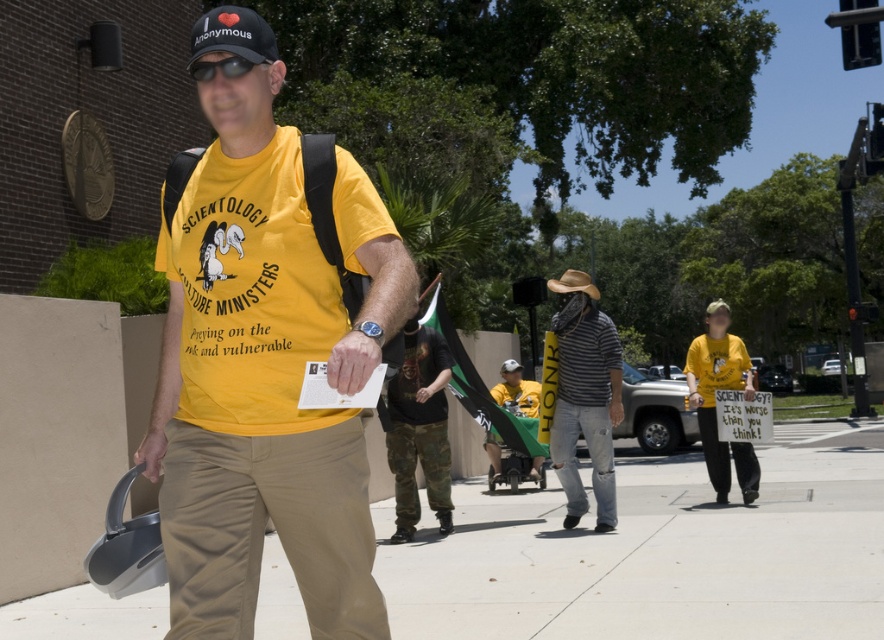
Question: Can you confirm if smooth concrete sidewalk at center is positioned above striped cotton shirt at center?

Choices:
 (A) no
 (B) yes

Answer: (A)

Question: Which of these objects is positioned closest to the camo pants at center?

Choices:
 (A) smooth concrete sidewalk at center
 (B) striped cotton shirt at center
 (C) yellow t-shirt at center

Answer: (B)

Question: Which point is farther to the camera?

Choices:
 (A) striped cotton shirt at center
 (B) yellow matte t-shirt at center

Answer: (A)

Question: Which object is closer to the camera taking this photo?

Choices:
 (A) yellow matte t-shirt at center
 (B) camo pants at center
 (C) striped cotton shirt at center

Answer: (A)

Question: Is camo pants at center to the right of yellow t-shirt at center from the viewer's perspective?

Choices:
 (A) no
 (B) yes

Answer: (A)

Question: Considering the relative positions of smooth concrete sidewalk at center and camo pants at center in the image provided, where is smooth concrete sidewalk at center located with respect to camo pants at center?

Choices:
 (A) above
 (B) below

Answer: (B)